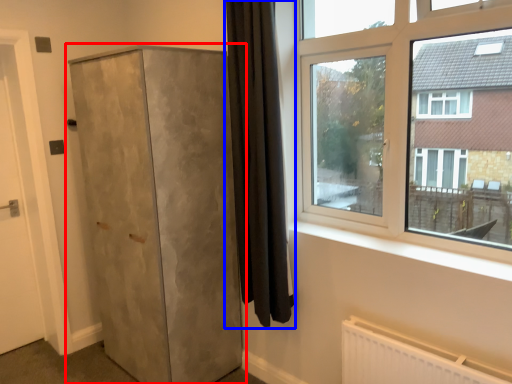
Question: Which object appears farthest to the camera in this image, cupboard (highlighted by a red box) or curtain (highlighted by a blue box)?

Choices:
 (A) cupboard
 (B) curtain

Answer: (A)